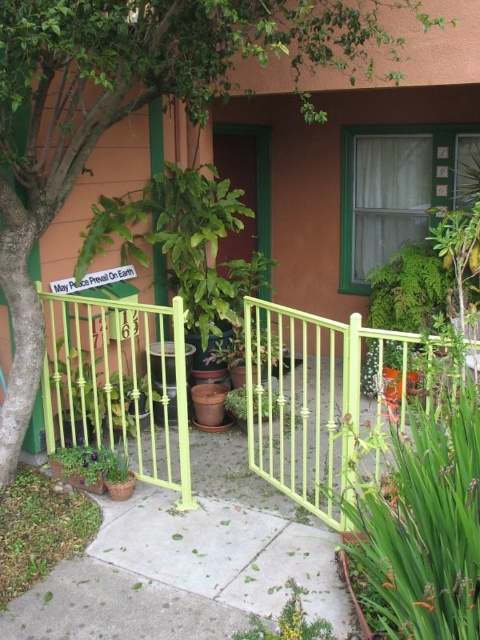
You are standing at the entrance of the residential area and want to walk towards the red door. Which object, the gray concrete pavement at center or the green leafy plant at center, should you step on to reach the door first?

You should step on the gray concrete pavement at center first because it is to the left of the green leafy plant at center, meaning it is closer to your starting position at the entrance.

You are standing at the entrance of the residential area and want to place a small decorative pot exactly at the point marked as point (420, 504). What object is located at that point?

The green leafy plant at center is located at point (420, 504).